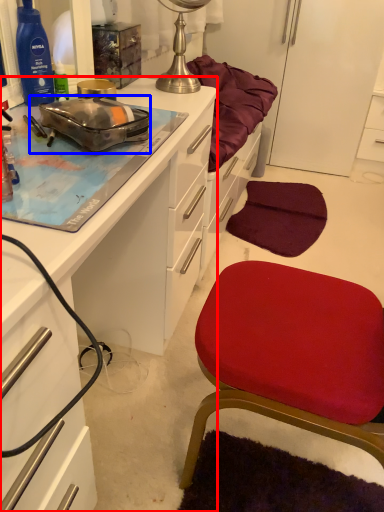
Question: Which object appears closest to the camera in this image, cabinetry (highlighted by a red box) or appliance (highlighted by a blue box)?

Choices:
 (A) cabinetry
 (B) appliance

Answer: (A)